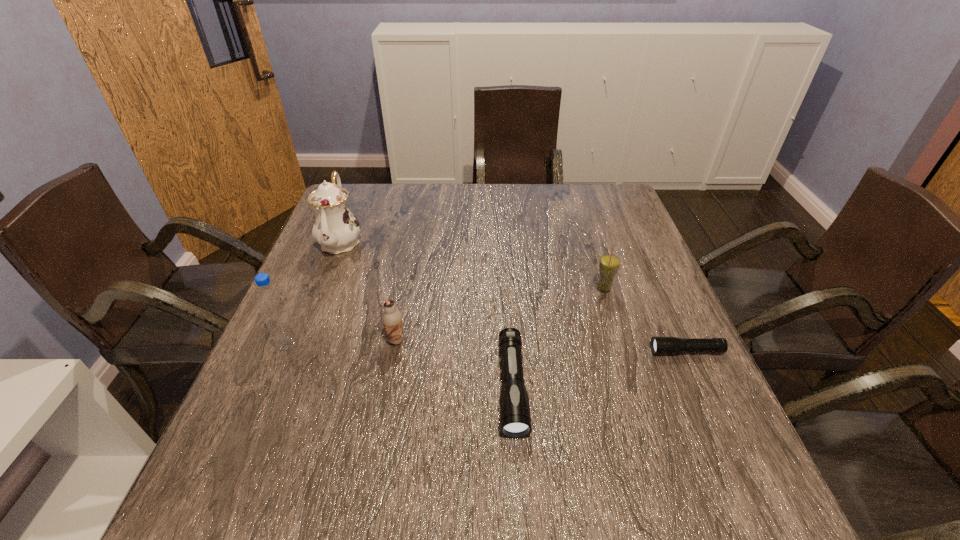
Image resolution: width=960 pixels, height=540 pixels. Find the location of `the fourth object from left to right`. the fourth object from left to right is located at coordinates (515, 419).

The image size is (960, 540). I want to click on the left flashlight, so click(515, 419).

In order to click on the rightmost object in this screenshot , I will do `click(659, 345)`.

Identify the location of the shortest object. (659, 345).

This screenshot has height=540, width=960. I want to click on the fifth object from left to right, so coord(609,264).

This screenshot has width=960, height=540. What are the coordinates of `the fourth shortest object` in the screenshot? It's located at click(609, 264).

Where is `the fourth object from right to left`? The image size is (960, 540). the fourth object from right to left is located at coordinates (391, 318).

This screenshot has height=540, width=960. Identify the location of the fourth tallest object. (391, 318).

Where is `water bottle`? The height and width of the screenshot is (540, 960). water bottle is located at coordinates (270, 299).

Image resolution: width=960 pixels, height=540 pixels. Find the location of `the farthest object`. the farthest object is located at coordinates (335, 228).